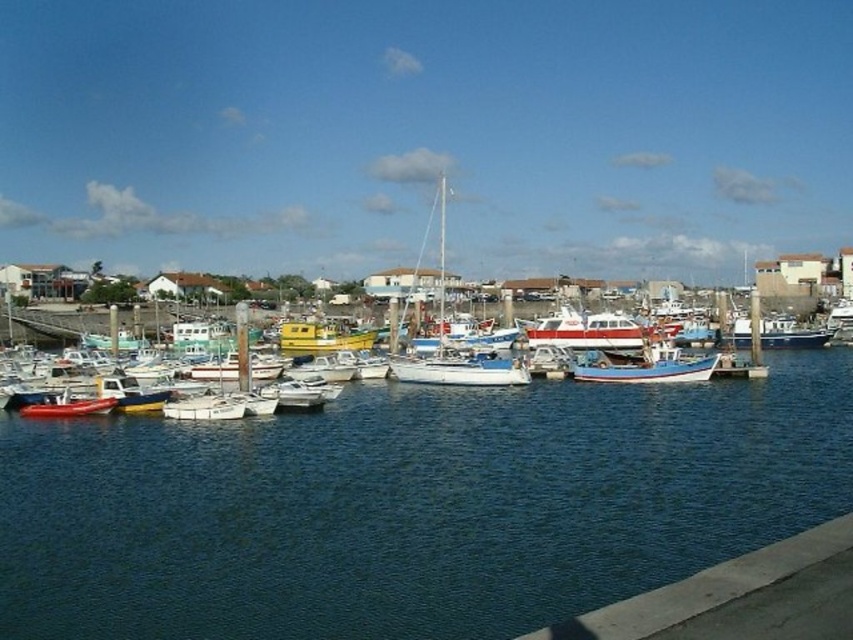
Is blue water at center bigger than white matte sailboat at center?

Incorrect, blue water at center is not larger than white matte sailboat at center.

Which is in front, point (62, 531) or point (422, 369)?

Point (62, 531)

Between point (496, 552) and point (485, 371), which one is positioned in front?

Point (496, 552)

What are the coordinates of `blue water at center` in the screenshot? It's located at (410, 506).

Does point (242, 390) lie behind point (474, 384)?

No, (242, 390) is in front of (474, 384).

Is white matte boat at center taller than white glossy sailboat at center?

Correct, white matte boat at center is much taller as white glossy sailboat at center.

Identify the location of white matte boat at center. (440, 250).

From the picture: Who is more forward, (584, 420) or (578, 362)?

Point (584, 420) is in front.

Between blue water at center and blue painted wooden boat at center, which one appears on the left side from the viewer's perspective?

blue water at center

This screenshot has width=853, height=640. In order to click on blue water at center in this screenshot , I will do `click(410, 506)`.